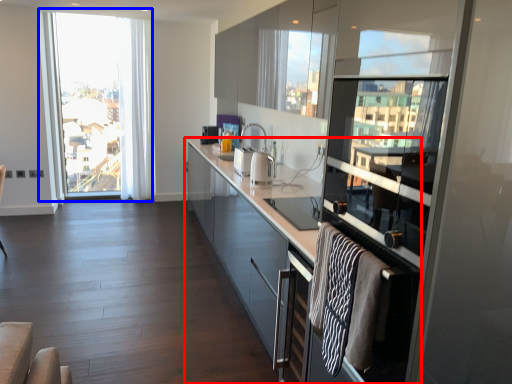
Question: Which point is further to the camera, cabinetry (highlighted by a red box) or window (highlighted by a blue box)?

Choices:
 (A) cabinetry
 (B) window

Answer: (B)